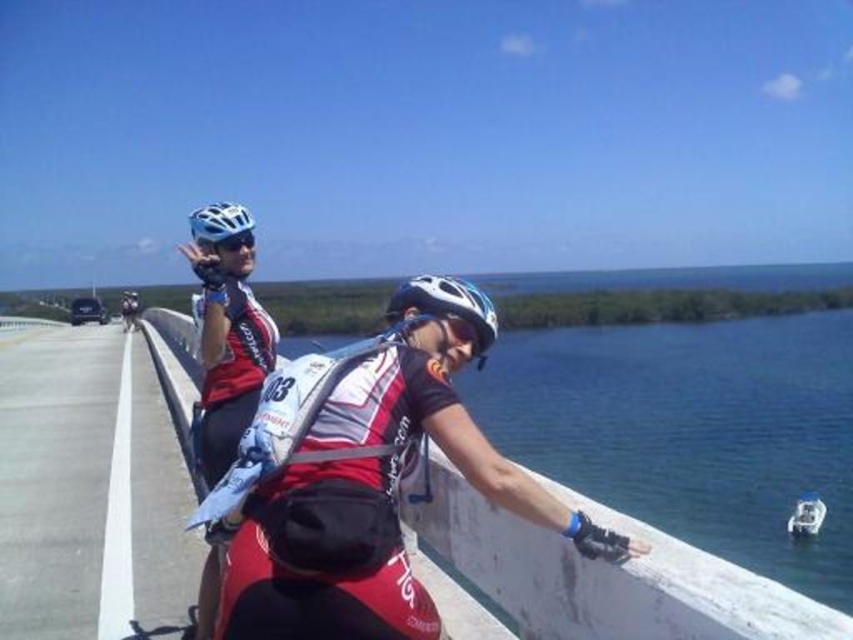
Is clear blue water at center wider than white matte bicycle helmet at center?

Indeed, clear blue water at center has a greater width compared to white matte bicycle helmet at center.

Does point (535, 548) come farther from viewer compared to point (440, 284)?

No, it is not.

Is point (532, 602) farther from camera compared to point (428, 292)?

No, (532, 602) is in front of (428, 292).

Find the location of a particular element. The image size is (853, 640). clear blue water at center is located at coordinates (602, 573).

In the scene shown: How far apart are white matte bicycle helmet at upper center and matte black helmet at upper left?

white matte bicycle helmet at upper center and matte black helmet at upper left are 52.50 meters apart.

The width and height of the screenshot is (853, 640). Describe the element at coordinates (219, 221) in the screenshot. I see `white matte bicycle helmet at upper center` at that location.

Who is more distant from viewer, [231,227] or [131,324]?

Point [131,324]

Where is `white matte bicycle helmet at upper center`? white matte bicycle helmet at upper center is located at coordinates (219, 221).

Can you confirm if clear blue water at center is shorter than matte black helmet at upper left?

Yes.

Does clear blue water at center lie in front of matte black helmet at upper left?

Yes, it is.

Locate an element on the screen. clear blue water at center is located at coordinates (602, 573).

The height and width of the screenshot is (640, 853). Find the location of `clear blue water at center`. clear blue water at center is located at coordinates (602, 573).